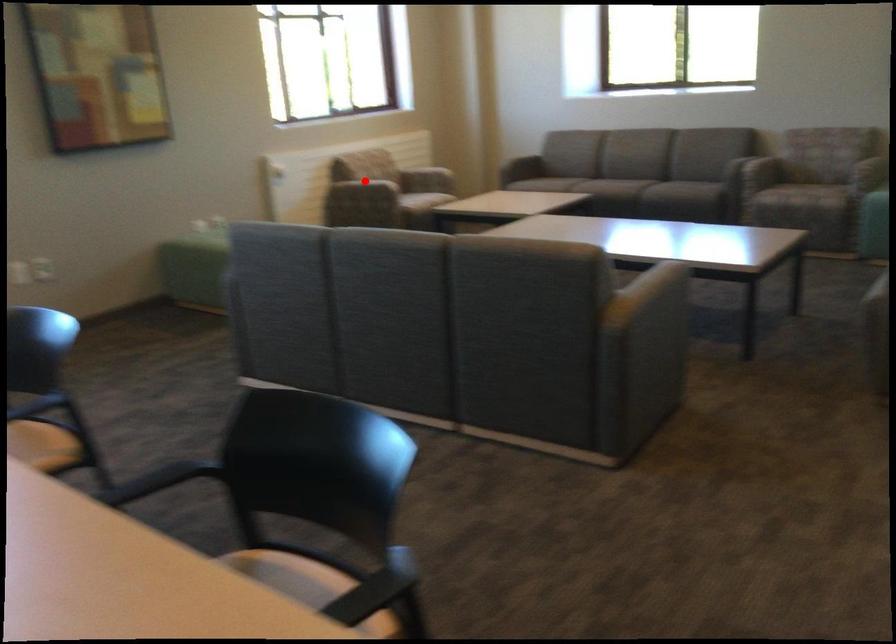
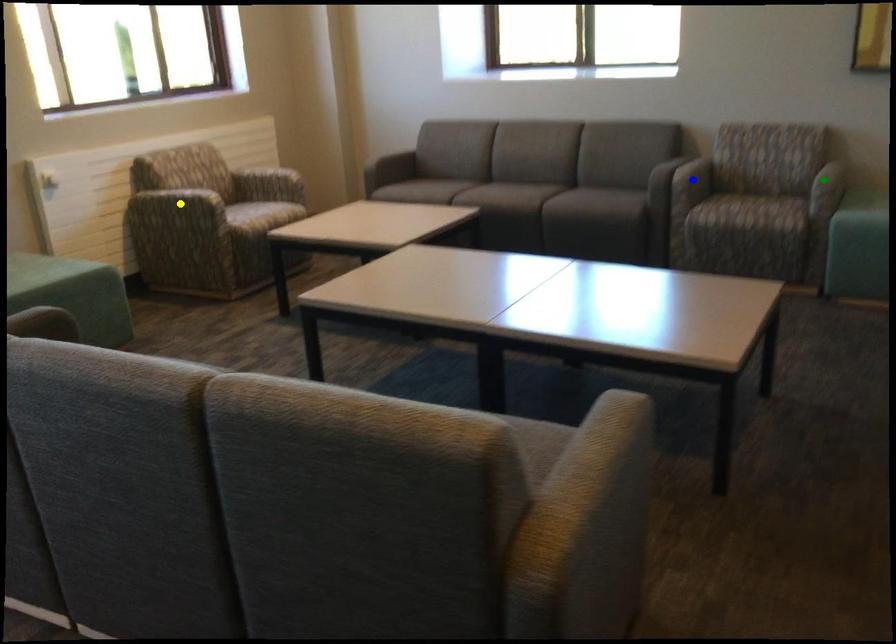
Question: I am providing you with two images of the same scene from different viewpoints. A red point is marked on the first image. You are given multiple points on the second image. Which point in image 2 is actually the same real-world point as the red point in image 1?

Choices:
 (A) blue point
 (B) green point
 (C) yellow point

Answer: (C)